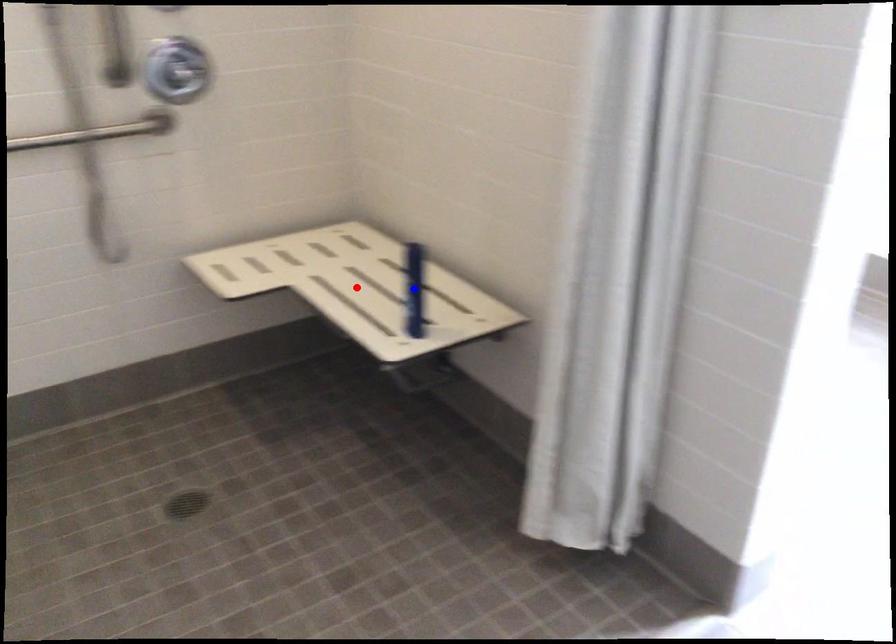
Question: In the image, two points are highlighted. Which point is nearer to the camera? Reply with the corresponding letter.

Choices:
 (A) blue point
 (B) red point

Answer: (A)